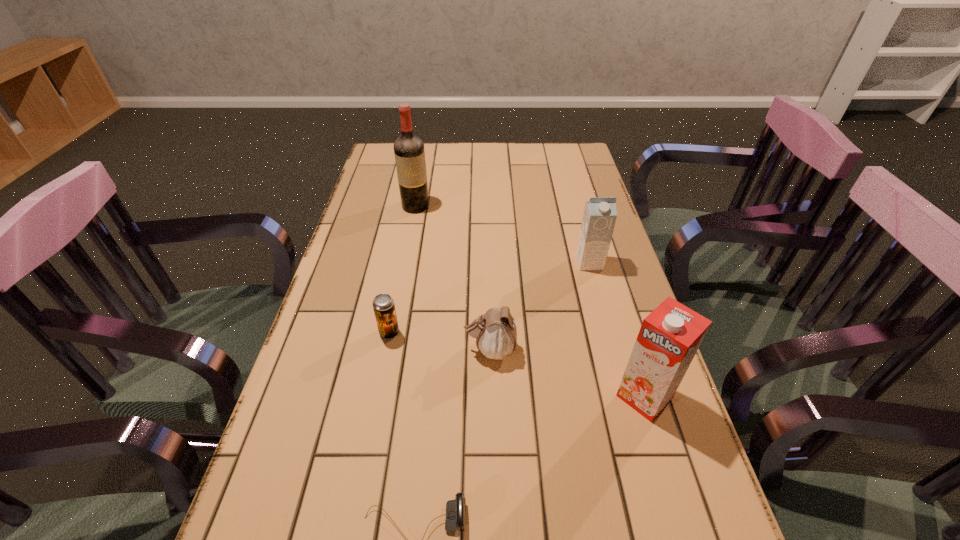
In the image, there is a desktop. What are the coordinates of `vacant space at the far right corner` in the screenshot? It's located at (554, 145).

This screenshot has width=960, height=540. Identify the location of vacant area between the second shortest object and the liquor. (402, 269).

Identify the location of vacant area between the fifth tallest object and the pouch. This screenshot has height=540, width=960. (440, 341).

You are a GUI agent. You are given a task and a screenshot of the screen. Output one action in this format:
    pyautogui.click(x=<x>, y=<y>)
    Task: Click on the free space that is in between the tallest object and the farther carton
    
    Given the screenshot: What is the action you would take?
    pyautogui.click(x=502, y=234)

Locate an element on the screen. vacant space that's between the fifth farthest object and the liquor is located at coordinates (530, 301).

What are the coordinates of `vacant area that lies between the fifth tallest object and the second farthest object` in the screenshot? It's located at (490, 298).

This screenshot has width=960, height=540. I want to click on free spot between the second tallest object and the tallest object, so click(x=530, y=301).

At what (x,y) coordinates should I click in order to perform the action: click on vacant area that lies between the nearer carton and the shorter carton. Please return your answer as a coordinate pair (x, y). Looking at the image, I should click on (617, 329).

Identify which object is the fourth nearest to the pouch. Please provide its 2D coordinates. Your answer should be formatted as a tuple, i.e. [(x, y)], where the tuple contains the x and y coordinates of a point satisfying the conditions above.

[(600, 213)]

Select which object is the second closest to the pouch. Please provide its 2D coordinates. Your answer should be formatted as a tuple, i.e. [(x, y)], where the tuple contains the x and y coordinates of a point satisfying the conditions above.

[(669, 337)]